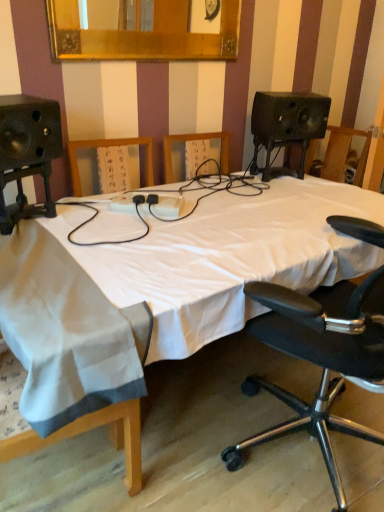
This screenshot has height=512, width=384. Describe the element at coordinates (163, 287) in the screenshot. I see `white fabric bed at center` at that location.

Image resolution: width=384 pixels, height=512 pixels. Identify the location of black leather office chair at right. (320, 358).

I want to click on white fabric bed at center, so click(x=163, y=287).

From the image's perspective, which is below, gold-framed mirror at upper center or black leather office chair at right?

black leather office chair at right appears lower in the image.

Considering the positions of objects gold-framed mirror at upper center and black leather office chair at right in the image provided, who is in front, gold-framed mirror at upper center or black leather office chair at right?

Positioned in front is black leather office chair at right.

Would you say gold-framed mirror at upper center is to the left or to the right of black leather office chair at right in the picture?

In the image, gold-framed mirror at upper center appears on the left side of black leather office chair at right.

Which of these two, gold-framed mirror at upper center or black leather office chair at right, stands shorter?

Standing shorter between the two is gold-framed mirror at upper center.

Can you tell me how much black leather office chair at right and white cloth at left differ in facing direction?

There is a 107-degree angle between the facing directions of black leather office chair at right and white cloth at left.

Is black leather office chair at right in front of or behind white cloth at left in the image?

Clearly, black leather office chair at right is in front of white cloth at left.

Can you confirm if black leather office chair at right is smaller than white cloth at left?

No, black leather office chair at right is not smaller than white cloth at left.

Which of these two, white cloth at left or black leather office chair at right, is smaller?

Smaller between the two is white cloth at left.

Is white cloth at left not near black leather office chair at right?

No, white cloth at left is in close proximity to black leather office chair at right.

From the image's perspective, is white cloth at left below black leather office chair at right?

Yes.

Is point (112, 332) behind point (241, 448)?

No.

Which point is more forward, (x=36, y=397) or (x=223, y=57)?

The point (x=36, y=397) is closer.

Is white cloth at left looking in the opposite direction of gold-framed mirror at upper center?

No.

Is gold-framed mirror at upper center surrounded by white cloth at left?

No, gold-framed mirror at upper center is not inside white cloth at left.

Can you confirm if black leather office chair at right is positioned to the left of white fabric bed at center?

In fact, black leather office chair at right is to the right of white fabric bed at center.

Is black leather office chair at right wider or thinner than white fabric bed at center?

Clearly, black leather office chair at right has less width compared to white fabric bed at center.

Considering their positions, is black leather office chair at right located in front of or behind white fabric bed at center?

In the image, black leather office chair at right appears in front of white fabric bed at center.

How distant is white fabric bed at center from black leather office chair at right?

A distance of 32.38 centimeters exists between white fabric bed at center and black leather office chair at right.

From the picture: Which of these two, white fabric bed at center or black leather office chair at right, is thinner?

With smaller width is black leather office chair at right.

Between white fabric bed at center and black leather office chair at right, which one appears on the left side from the viewer's perspective?

From the viewer's perspective, white fabric bed at center appears more on the left side.

Does point (134, 219) appear closer or farther from the camera than point (240, 447)?

Point (134, 219) is farther from the camera than point (240, 447).

Is point (65, 369) positioned behind point (92, 406)?

No, it is not.

Could you tell me if white fabric bed at center is facing white cloth at left?

No.

From the image's perspective, would you say white fabric bed at center is shown under white cloth at left?

No, from the image's perspective, white fabric bed at center is not beneath white cloth at left.

From the picture: Which of these two, white fabric bed at center or white cloth at left, stands shorter?

white fabric bed at center.

Locate an element on the screen. The width and height of the screenshot is (384, 512). chair below the gold-framed mirror at upper center (from the image's perspective) is located at coordinates coord(320,358).

Where is `sheet below the black leather office chair at right (from a real-world perspective)`? sheet below the black leather office chair at right (from a real-world perspective) is located at coordinates (67, 332).

From the image, which object appears to be nearer to black leather office chair at right, white fabric bed at center or gold-framed mirror at upper center?

white fabric bed at center is closer to black leather office chair at right.

Based on their spatial positions, is white cloth at left or gold-framed mirror at upper center closer to black leather office chair at right?

white cloth at left.

Looking at the image, which one is located closer to white fabric bed at center, white cloth at left or black leather office chair at right?

Based on the image, white cloth at left appears to be nearer to white fabric bed at center.

From the image, which object appears to be nearer to black leather office chair at right, white cloth at left or white fabric bed at center?

The object closer to black leather office chair at right is white fabric bed at center.

Estimate the real-world distances between objects in this image. Which object is further from gold-framed mirror at upper center, black leather office chair at right or white fabric bed at center?

black leather office chair at right lies further to gold-framed mirror at upper center than the other object.

Estimate the real-world distances between objects in this image. Which object is further from white cloth at left, black leather office chair at right or white fabric bed at center?

Based on the image, black leather office chair at right appears to be further to white cloth at left.

Which object lies further to the anchor point white cloth at left, white fabric bed at center or gold-framed mirror at upper center?

Based on the image, gold-framed mirror at upper center appears to be further to white cloth at left.

Looking at this image, looking at the image, which one is located closer to gold-framed mirror at upper center, white fabric bed at center or black leather office chair at right?

white fabric bed at center.

Find the location of a particular element. bed between gold-framed mirror at upper center and white cloth at left vertically is located at coordinates (163, 287).

In order to click on chair between gold-framed mirror at upper center and white cloth at left vertically in this screenshot , I will do `click(320, 358)`.

Identify the location of bed between white cloth at left and black leather office chair at right. This screenshot has width=384, height=512. (163, 287).

I want to click on bed between gold-framed mirror at upper center and black leather office chair at right in the up-down direction, so click(x=163, y=287).